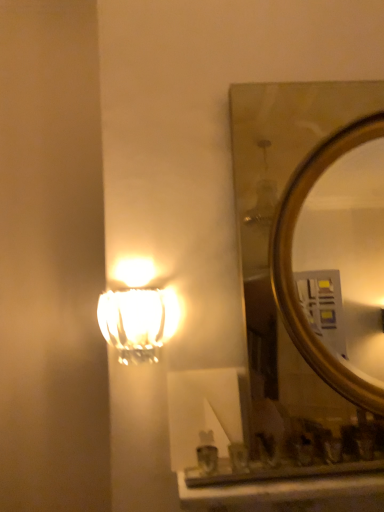
Question: Considering the relative positions of gold metallic mirror at upper right and translucent glass lamp at upper left in the image provided, is gold metallic mirror at upper right to the left or to the right of translucent glass lamp at upper left?

Choices:
 (A) right
 (B) left

Answer: (A)

Question: Is gold metallic mirror at upper right inside the boundaries of translucent glass lamp at upper left, or outside?

Choices:
 (A) outside
 (B) inside

Answer: (A)

Question: From a real-world perspective, relative to translucent glass lamp at upper left, is gold metallic mirror at upper right vertically above or below?

Choices:
 (A) above
 (B) below

Answer: (A)

Question: Would you say translucent glass lamp at upper left is to the left or to the right of gold metallic mirror at upper right in the picture?

Choices:
 (A) left
 (B) right

Answer: (A)

Question: Based on their sizes in the image, would you say translucent glass lamp at upper left is bigger or smaller than gold metallic mirror at upper right?

Choices:
 (A) big
 (B) small

Answer: (B)

Question: In the image, is translucent glass lamp at upper left positioned in front of or behind gold metallic mirror at upper right?

Choices:
 (A) behind
 (B) front

Answer: (B)

Question: Would you say translucent glass lamp at upper left is inside or outside gold metallic mirror at upper right?

Choices:
 (A) outside
 (B) inside

Answer: (A)